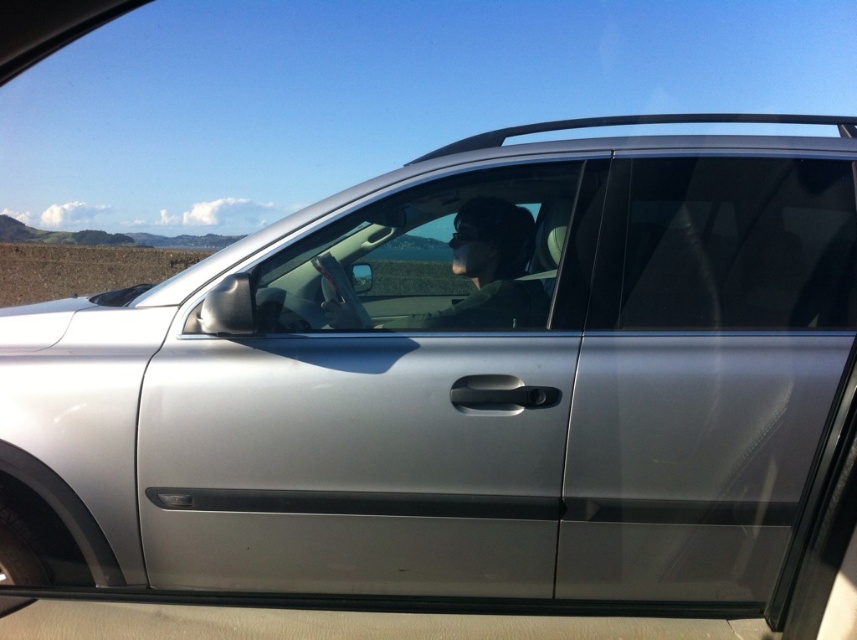
You are a delivery robot with a package that is 6 inches wide. You need to place it between the silver metallic car door at center and the clear glass window at center. Can the package fit in that space?

The distance between the silver metallic car door at center and the clear glass window at center is 6.31 inches. Since the package is 6 inches wide, it can fit in the space between them.

You are standing at the point marked with coordinates point (376, 397). What object are you standing on?

The point (376, 397) corresponds to the silver metallic car door at center, so you are standing on the silver metallic car door at center.

You are standing at the origin point of the image coordinate system. You want to approach the silver metallic car door at center. In which direction should you move relative to your current position?

Since the silver metallic car door at center is located at point (376, 397) in the image coordinate system, you should move towards the right and slightly downward to reach it from the origin point.